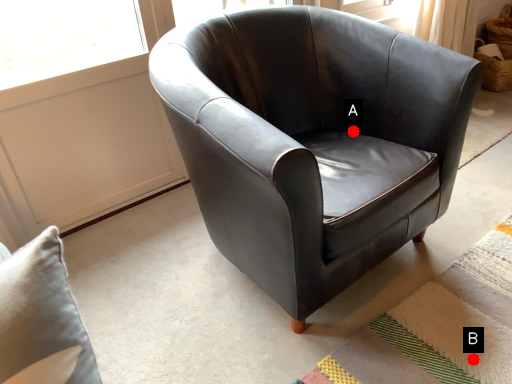
Question: Two points are circled on the image, labeled by A and B beside each circle. Which of the following is the closest to the observer?

Choices:
 (A) A is closer
 (B) B is closer

Answer: (B)